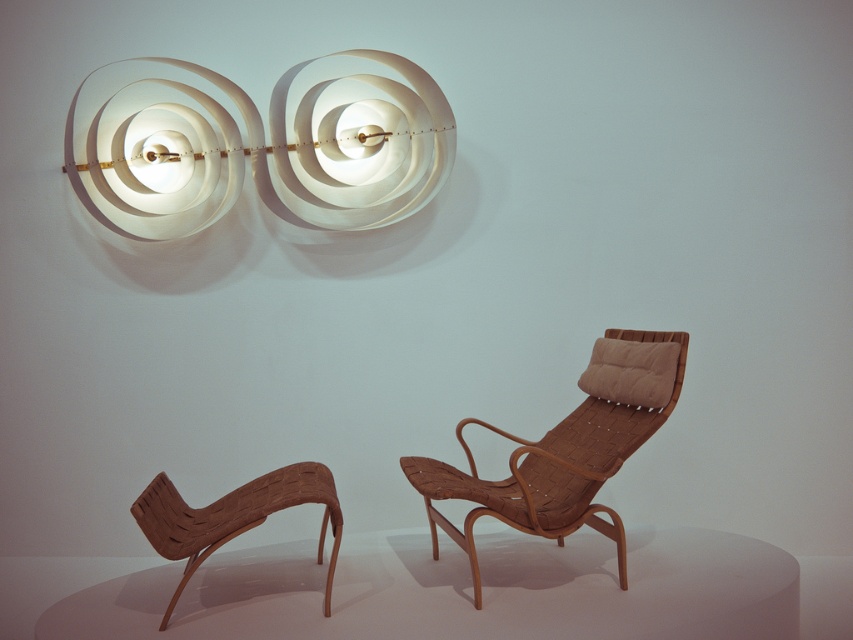
Question: Can you confirm if white paper lamp at upper center is positioned above brown woven wood armchair at center?

Choices:
 (A) yes
 (B) no

Answer: (A)

Question: Which point is closer to the camera?

Choices:
 (A) (279, 477)
 (B) (583, 381)

Answer: (A)

Question: Is white paper lamp at upper center wider than brown woven wood armchair at center?

Choices:
 (A) yes
 (B) no

Answer: (A)

Question: Among these points, which one is farthest from the camera?

Choices:
 (A) (425, 76)
 (B) (604, 374)
 (C) (329, 573)

Answer: (A)

Question: Which point is farther to the camera?

Choices:
 (A) (554, 426)
 (B) (444, 113)

Answer: (B)

Question: Is white paper lamp at upper center to the right of brown woven wood armchair at center from the viewer's perspective?

Choices:
 (A) yes
 (B) no

Answer: (B)